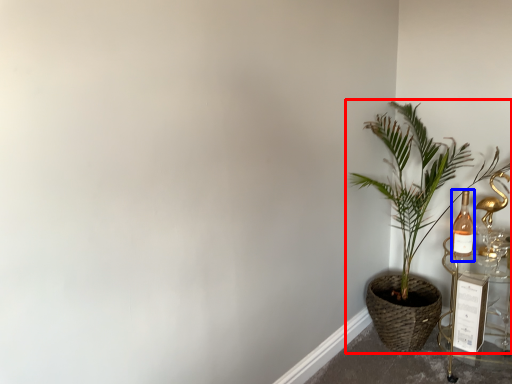
Question: Which of the following is the farthest to the observer, houseplant (highlighted by a red box) or bottle (highlighted by a blue box)?

Choices:
 (A) houseplant
 (B) bottle

Answer: (B)